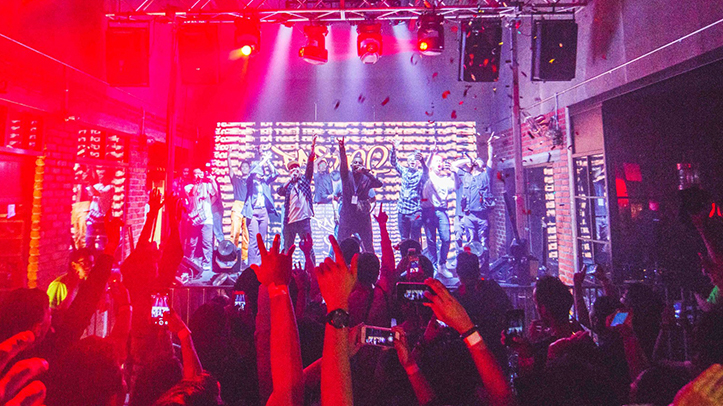
I want to click on lights, so click(377, 45), click(419, 47), click(299, 46), click(234, 44).